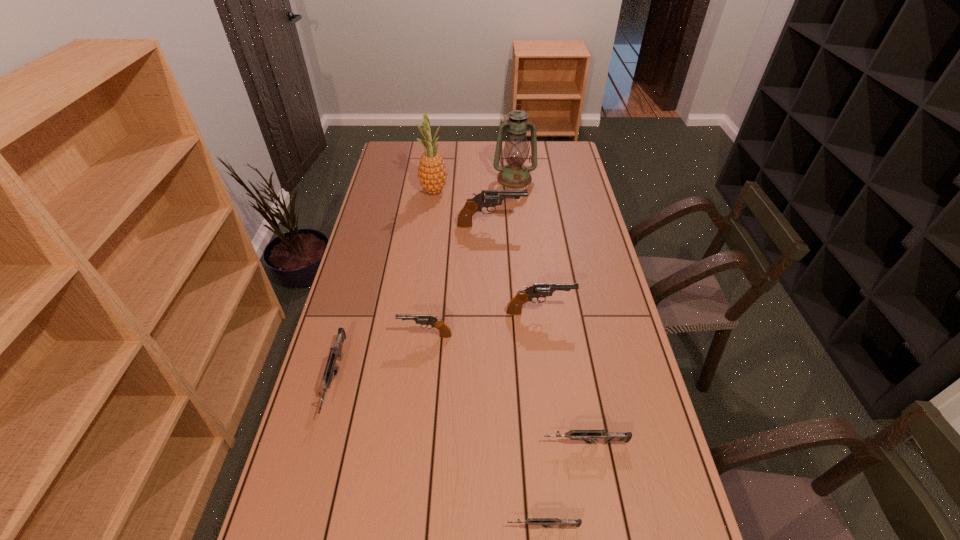
Locate an element on the screen. This screenshot has height=540, width=960. free space at the right edge of the desktop is located at coordinates (605, 354).

Locate an element on the screen. The width and height of the screenshot is (960, 540). free spot between the second shortest gun and the pineapple is located at coordinates (510, 317).

Find the location of a particular element. This screenshot has height=540, width=960. vacant region between the smallest black gun and the fifth nearest object is located at coordinates [x=483, y=324].

In order to click on vacant space that is in between the oil lamp and the nearest grey gun in this screenshot , I will do `click(529, 353)`.

The image size is (960, 540). In order to click on empty space that is in between the farthest grey gun and the farthest black gun in this screenshot , I will do `click(413, 301)`.

Where is `vacant region between the third farthest gun and the pineapple`? vacant region between the third farthest gun and the pineapple is located at coordinates [x=430, y=263].

Find the location of `free area in between the pineapple and the shortest object`. free area in between the pineapple and the shortest object is located at coordinates (489, 359).

You are a GUI agent. You are given a task and a screenshot of the screen. Output one action in this format:
    pyautogui.click(x=<x>, y=<y>)
    Task: Click on the blank region between the tallest gun and the fourth nearest gun
    
    Given the screenshot: What is the action you would take?
    pyautogui.click(x=458, y=280)

This screenshot has width=960, height=540. I want to click on free spot between the leftmost gun and the fifth tallest object, so click(x=380, y=356).

The image size is (960, 540). In order to click on free spot between the leftmost gun and the tallest gun in this screenshot , I will do `click(413, 301)`.